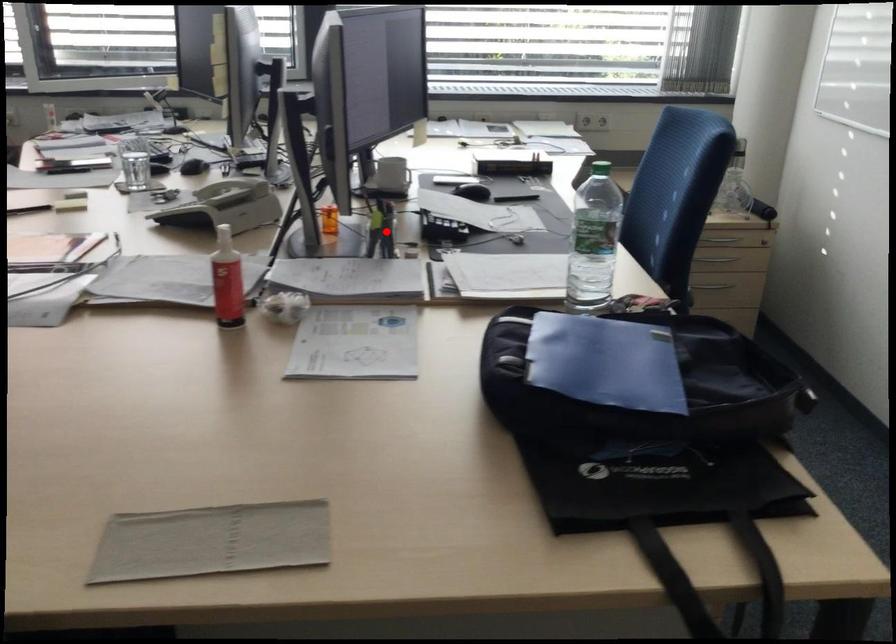
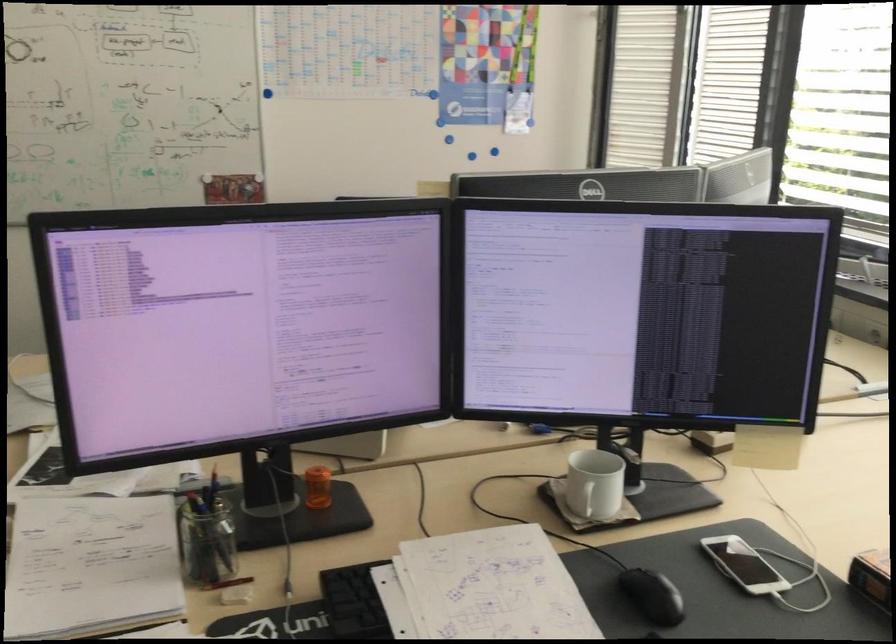
Question: I am providing you with two images of the same scene from different viewpoints. A red point is shown in image1. For the corresponding object point in image2, is it positioned nearer or farther from the camera?

Choices:
 (A) Nearer
 (B) Farther

Answer: (A)